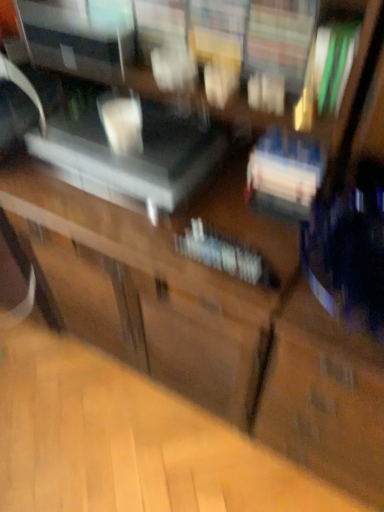
Question: From a real-world perspective, is white glossy book at center located higher than satin silver speaker at center?

Choices:
 (A) yes
 (B) no

Answer: (B)

Question: Considering the relative positions of white glossy book at center and satin silver speaker at center in the image provided, is white glossy book at center in front of satin silver speaker at center?

Choices:
 (A) yes
 (B) no

Answer: (A)

Question: Is white glossy book at center positioned beyond the bounds of satin silver speaker at center?

Choices:
 (A) no
 (B) yes

Answer: (B)

Question: Is white glossy book at center positioned with its back to satin silver speaker at center?

Choices:
 (A) no
 (B) yes

Answer: (A)

Question: Are white glossy book at center and satin silver speaker at center beside each other?

Choices:
 (A) yes
 (B) no

Answer: (B)

Question: Is white glossy book at center behind satin silver speaker at center?

Choices:
 (A) no
 (B) yes

Answer: (A)

Question: Is satin silver speaker at center to the right of white glossy book at center from the viewer's perspective?

Choices:
 (A) no
 (B) yes

Answer: (A)

Question: Does satin silver speaker at center come behind white glossy book at center?

Choices:
 (A) yes
 (B) no

Answer: (A)

Question: Is satin silver speaker at center positioned in front of white glossy book at center?

Choices:
 (A) no
 (B) yes

Answer: (A)

Question: Is satin silver speaker at center outside of white glossy book at center?

Choices:
 (A) yes
 (B) no

Answer: (A)

Question: Is satin silver speaker at center wider than white glossy book at center?

Choices:
 (A) yes
 (B) no

Answer: (A)

Question: From a real-world perspective, does satin silver speaker at center stand above white glossy book at center?

Choices:
 (A) yes
 (B) no

Answer: (A)

Question: From the image's perspective, is satin silver speaker at center positioned above or below white glossy book at center?

Choices:
 (A) below
 (B) above

Answer: (B)